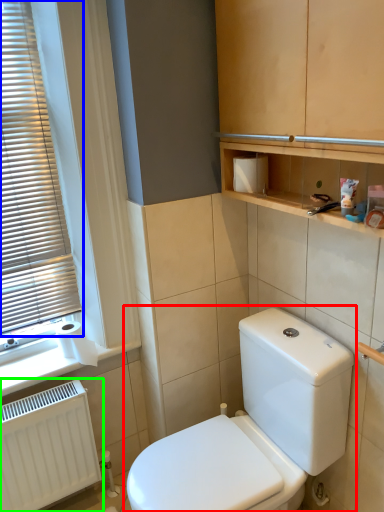
Question: Considering the real-world distances, which object is closest to toilet (highlighted by a red box)? window blind (highlighted by a blue box) or radiator (highlighted by a green box).

Choices:
 (A) window blind
 (B) radiator

Answer: (B)